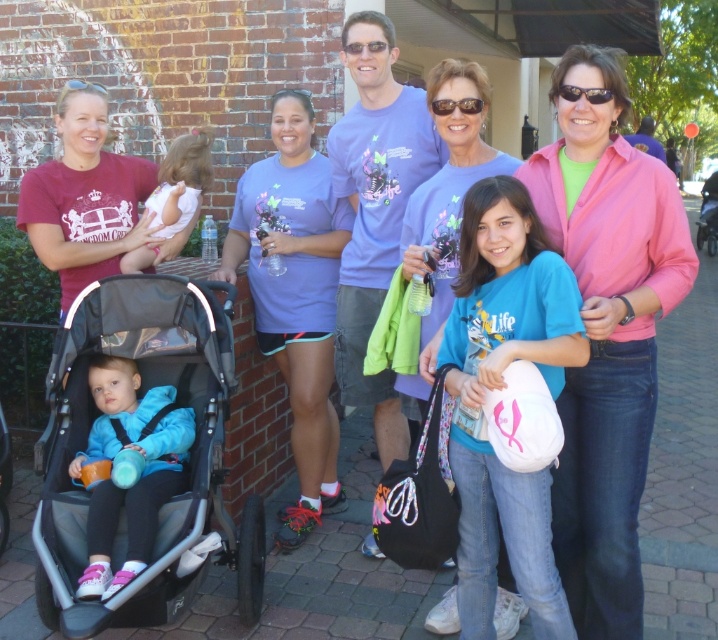
Based on the photo, you are a photographer who needs to adjust the lighting for the pink satin jacket at center and the matte blue jacket at lower left. Which jacket should you move closer to the light source to ensure both are equally illuminated, considering their positions?

The matte blue jacket at lower left should be moved closer to the light source because it is positioned to the left of the pink satin jacket at center, which is already to the right and might be receiving more light.